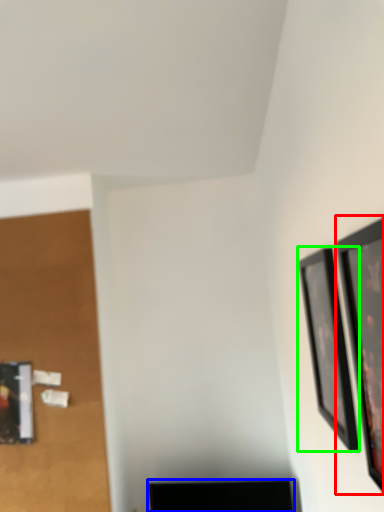
Question: Which is farther away from picture frame (highlighted by a red box)? furniture (highlighted by a blue box) or picture frame (highlighted by a green box)?

Choices:
 (A) furniture
 (B) picture frame

Answer: (A)